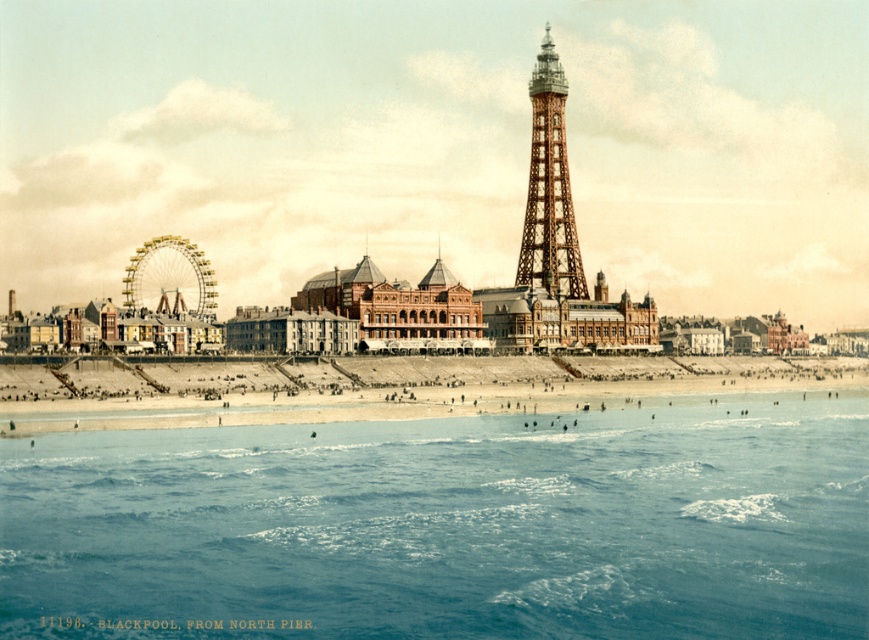
Question: Among these objects, which one is nearest to the camera?

Choices:
 (A) brown wooden lattice tower at center-right
 (B) blue water at lower center

Answer: (B)

Question: Does metallic ferris wheel at center left appear under brown wooden lattice tower at center-right?

Choices:
 (A) yes
 (B) no

Answer: (A)

Question: Which object is the farthest from the beige sand beach at lower center?

Choices:
 (A) brown wooden lattice tower at center-right
 (B) metallic ferris wheel at center left
 (C) blue water at lower center
 (D) gold metallic ferris wheel at left

Answer: (D)

Question: From the image, what is the correct spatial relationship of metallic ferris wheel at center left in relation to brown wooden lattice tower at center-right?

Choices:
 (A) left
 (B) right

Answer: (A)

Question: Which point appears closest to the camera in this image?

Choices:
 (A) (556, 253)
 (B) (131, 262)
 (C) (589, 392)

Answer: (C)

Question: Is metallic ferris wheel at center left positioned behind brown wooden lattice tower at center-right?

Choices:
 (A) no
 (B) yes

Answer: (A)